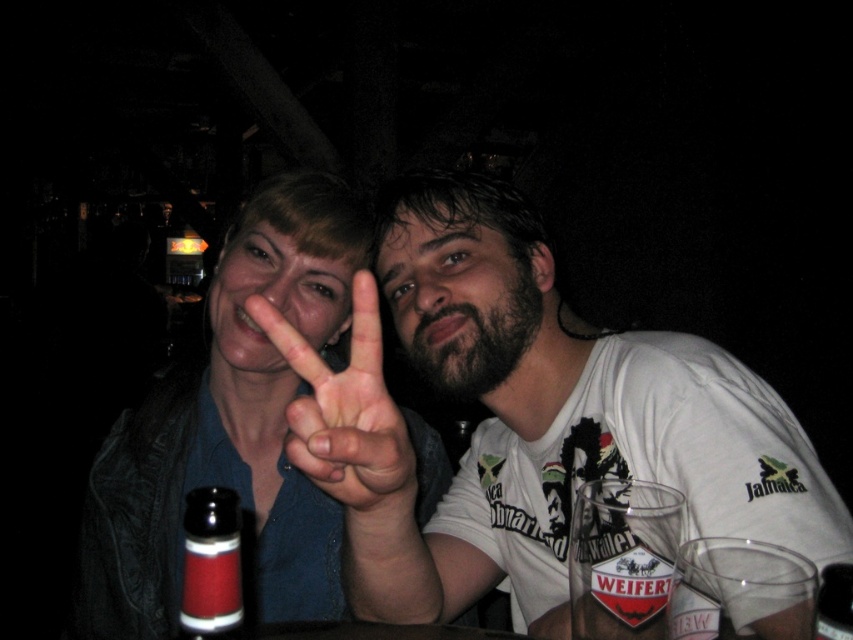
Question: Which object appears farthest from the camera in this image?

Choices:
 (A) red glass bottle at center
 (B) matte skin hand at center
 (C) white cotton t-shirt at center

Answer: (C)

Question: Estimate the real-world distances between objects in this image. Which object is farther from the white cotton t-shirt at center?

Choices:
 (A) red glass bottle at center
 (B) matte skin hand at center

Answer: (A)

Question: Considering the real-world distances, which object is closest to the white cotton t-shirt at center?

Choices:
 (A) red glass bottle at center
 (B) matte skin hand at center

Answer: (B)

Question: Considering the relative positions of white cotton t-shirt at center and matte skin hand at center in the image provided, where is white cotton t-shirt at center located with respect to matte skin hand at center?

Choices:
 (A) below
 (B) above

Answer: (A)

Question: Is matte skin hand at center thinner than red glass bottle at center?

Choices:
 (A) yes
 (B) no

Answer: (B)

Question: Can you confirm if white cotton t-shirt at center is positioned to the left of red glass bottle at center?

Choices:
 (A) no
 (B) yes

Answer: (A)